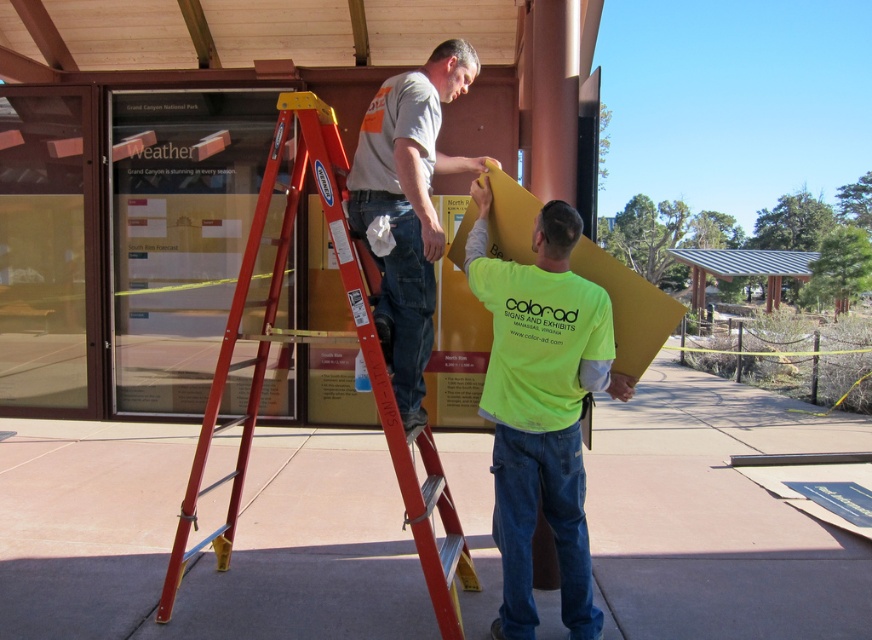
Consider the image. You are standing at the point labeled point (283,259) and want to move to the point labeled point (501,378). Which direction should you move to get closer to the camera?

You should move towards the point labeled point (501,378) because it is closer to the camera than point (283,259).

You are a delivery person approaching the building and need to place a package on the ground near the red metal ladder at center. However, you must avoid stepping on the matte gray shirt at center. Can you safely place the package near the ladder without stepping on the shirt?

The red metal ladder at center is further to the viewer than the matte gray shirt at center, so placing the package near the ladder would require moving towards the ladder, which is closer to you. Since the matte gray shirt at center is behind the ladder, you can safely place the package near the ladder without stepping on the shirt.